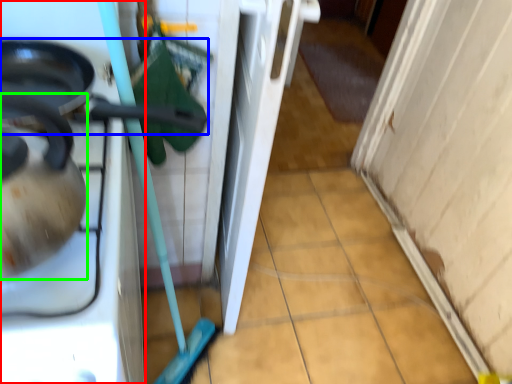
Question: Which object is the farthest from home appliance (highlighted by a red box)? Choose among these: frying pan (highlighted by a blue box) or tea pot (highlighted by a green box).

Choices:
 (A) frying pan
 (B) tea pot

Answer: (B)